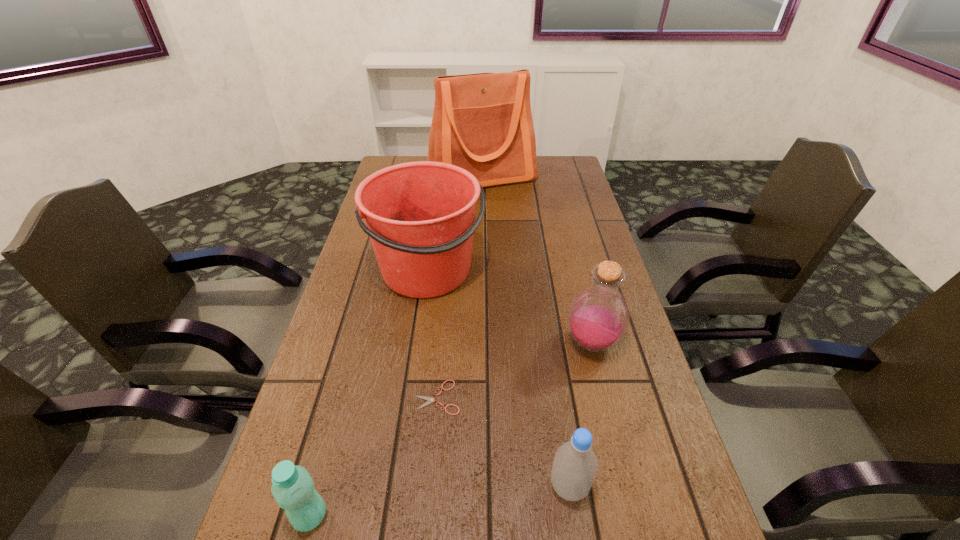
Where is `object that is at the far right corner`? object that is at the far right corner is located at coordinates (482, 122).

Where is `vacant space at the left edge of the desktop`? The image size is (960, 540). vacant space at the left edge of the desktop is located at coordinates (298, 409).

I want to click on vacant area at the right edge of the desktop, so click(x=569, y=305).

The height and width of the screenshot is (540, 960). In the image, there is a desktop. Identify the location of free region at the far left corner. (408, 160).

This screenshot has width=960, height=540. What are the coordinates of `free area in between the farthest object and the second bottle from right to left` in the screenshot? It's located at (525, 332).

Image resolution: width=960 pixels, height=540 pixels. I want to click on free space between the shears and the second bottle from right to left, so click(503, 442).

This screenshot has height=540, width=960. Find the location of `vacant area that lies between the fifth nearest object and the leftmost bottle`. vacant area that lies between the fifth nearest object and the leftmost bottle is located at coordinates (370, 394).

At what (x,y) coordinates should I click in order to perform the action: click on vacant point located between the second bottle from left to right and the bucket. Please return your answer as a coordinate pair (x, y). This screenshot has height=540, width=960. Looking at the image, I should click on (499, 379).

You are a GUI agent. You are given a task and a screenshot of the screen. Output one action in this format:
    pyautogui.click(x=<x>, y=<y>)
    Task: Click on the vacant point located between the tallest object and the second bottle from right to left
    The width and height of the screenshot is (960, 540).
    Given the screenshot: What is the action you would take?
    pyautogui.click(x=525, y=332)

Where is `empty space that is in between the second bottle from right to left and the farthest object`? empty space that is in between the second bottle from right to left and the farthest object is located at coordinates (525, 332).